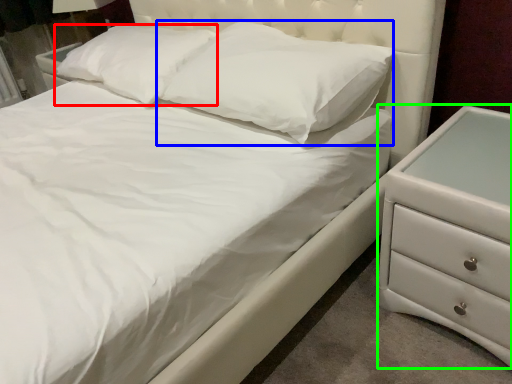
Question: Which object is the farthest from pillow (highlighted by a red box)? Choose among these: pillow (highlighted by a blue box) or chest of drawers (highlighted by a green box).

Choices:
 (A) pillow
 (B) chest of drawers

Answer: (B)